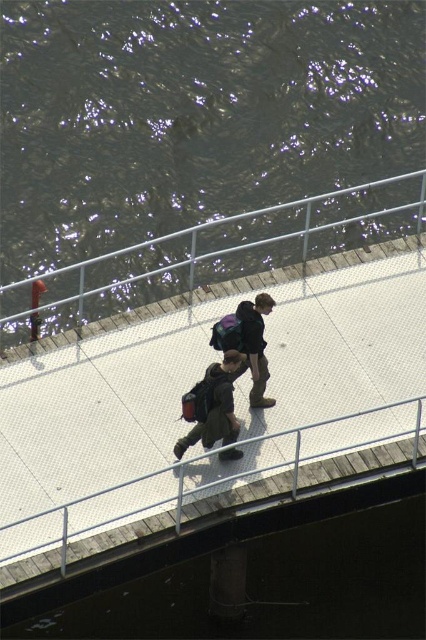
Question: Which object is farther from the camera taking this photo?

Choices:
 (A) white textured pavement at center
 (B) white textured rail at center

Answer: (A)

Question: Is white textured pavement at center closer to camera compared to metallic silver rail at center?

Choices:
 (A) no
 (B) yes

Answer: (B)

Question: Does camouflage fabric backpack at center have a greater width compared to dark brown leather jacket at center?

Choices:
 (A) no
 (B) yes

Answer: (B)

Question: Which point is farther from the camera taking this photo?

Choices:
 (A) (368, 627)
 (B) (259, 388)
 (C) (120, 280)

Answer: (C)

Question: Which is farther from the white textured rail at center?

Choices:
 (A) white textured pavement at center
 (B) transparent water at bridge center

Answer: (B)

Question: Can you confirm if white textured pavement at center is positioned below dark brown leather jacket at center?

Choices:
 (A) no
 (B) yes

Answer: (B)